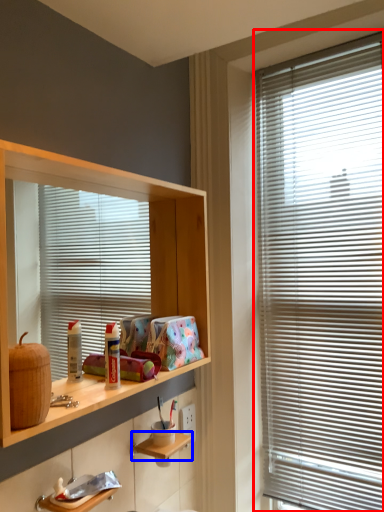
Question: Which object is closer to the camera taking this photo, window blind (highlighted by a red box) or shelf (highlighted by a blue box)?

Choices:
 (A) window blind
 (B) shelf

Answer: (B)